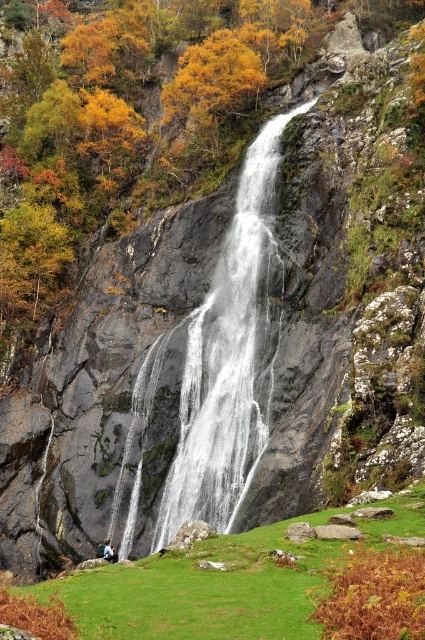
Question: Is green grassy at lower center positioned before blue denim jacket at lower center?

Choices:
 (A) no
 (B) yes

Answer: (B)

Question: Based on their relative distances, which object is nearer to the white frothy water at center?

Choices:
 (A) green grassy at lower center
 (B) blue denim jacket at lower center

Answer: (B)

Question: Does white frothy water at center appear on the right side of blue denim jacket at lower center?

Choices:
 (A) yes
 (B) no

Answer: (A)

Question: Which point is closer to the camera taking this photo?

Choices:
 (A) (289, 118)
 (B) (232, 572)
 (C) (108, 556)

Answer: (B)

Question: Among these objects, which one is nearest to the camera?

Choices:
 (A) green grassy at lower center
 (B) white frothy water at center

Answer: (A)

Question: Does green grassy at lower center have a larger size compared to blue denim jacket at lower center?

Choices:
 (A) no
 (B) yes

Answer: (B)